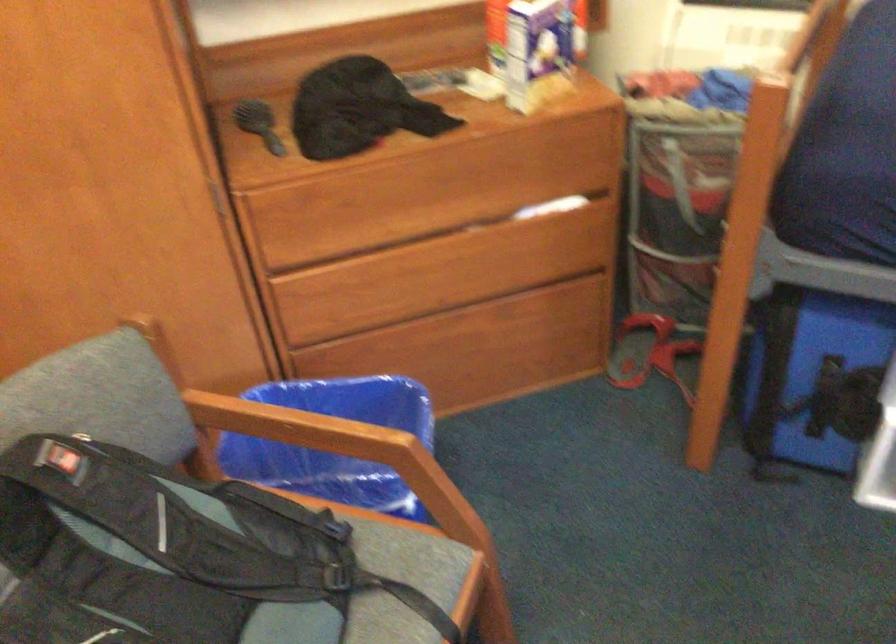
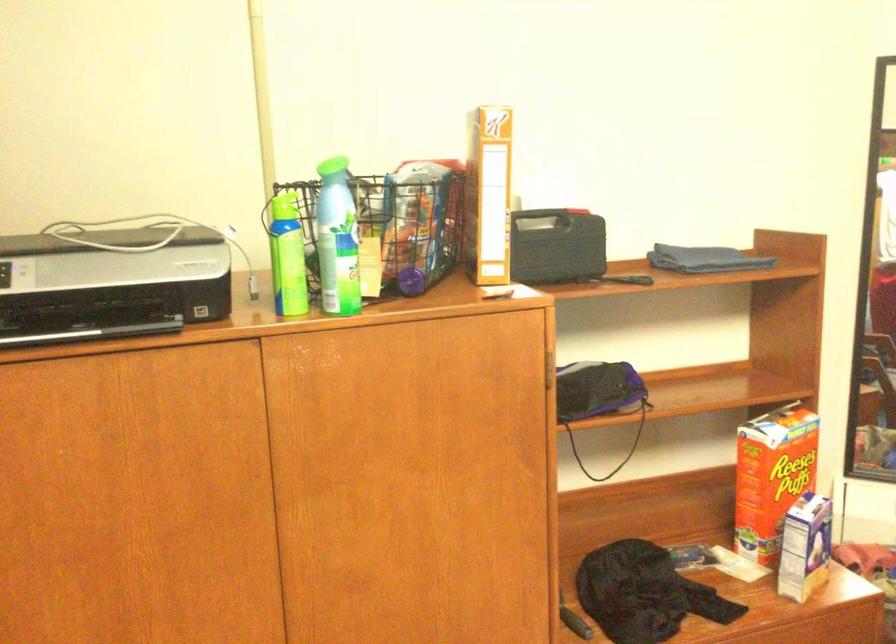
Question: The images are taken continuously from a first-person perspective. In which direction are you moving?

Choices:
 (A) Left
 (B) Right
 (C) Forward
 (D) Backward

Answer: (A)